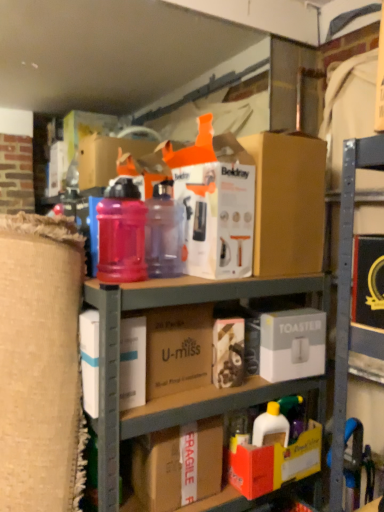
Question: Considering their positions, is white cardboard box at center, marked as the third box in a top-to-bottom arrangement, located in front of or behind brown cardboard at center, the 2th cardboard box positioned from the bottom?

Choices:
 (A) behind
 (B) front

Answer: (B)

Question: In the image, is white cardboard box at center, marked as the third box in a top-to-bottom arrangement, on the left side or the right side of brown cardboard at center, the 2th cardboard box positioned from the bottom?

Choices:
 (A) right
 (B) left

Answer: (B)

Question: Considering the real-world distances, which object is closest to the translucent plastic water bottle at center, which is counted as the second bottle, starting from the right?

Choices:
 (A) translucent plastic water bottle at center, acting as the 1th bottle starting from the right
 (B) fragile cardboard box at lower center, acting as the 1th cardboard box starting from the bottom
 (C) brown cardboard at center, the 2th cardboard box positioned from the bottom
 (D) white cardboard toaster at center, which ranks as the 2th box in top-to-bottom order
 (E) brown cardboard box at upper center, which appears as the 1th box when viewed from the top

Answer: (A)

Question: Which is nearer to the translucent plastic water bottle at center, the first bottle when ordered from left to right?

Choices:
 (A) white cardboard box at center, marked as the third box in a top-to-bottom arrangement
 (B) white cardboard toaster at center, which appears as the 3th box when ordered from the bottom
 (C) fragile cardboard box at lower center, acting as the 1th cardboard box starting from the bottom
 (D) brown cardboard box at upper center, acting as the fourth box starting from the bottom
 (E) brown cardboard at center, the 2th cardboard box positioned from the bottom

Answer: (A)